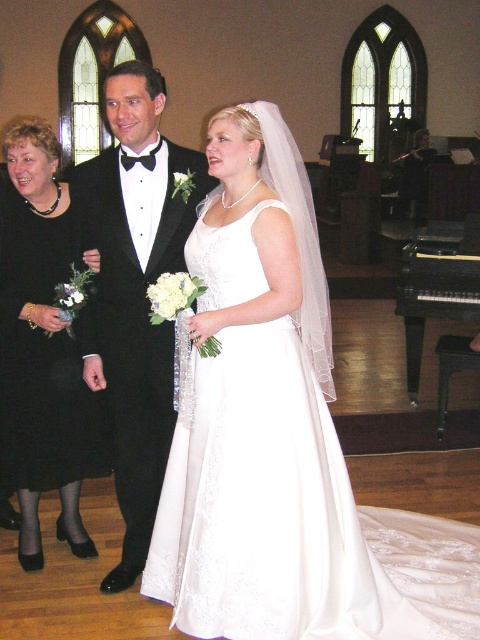
Can you confirm if white satin dress at center is bigger than black satin dress at left?

Yes, white satin dress at center is bigger than black satin dress at left.

Based on the photo, does white satin dress at center appear under black satin dress at left?

Yes.

Who is more distant from viewer, (x=410, y=604) or (x=36, y=531)?

The point (x=36, y=531) is more distant.

Find the location of a particular element. white satin dress at center is located at coordinates (291, 516).

In the scene shown: Can you confirm if black satin dress at left is positioned to the right of black polished wood piano at right?

No, black satin dress at left is not to the right of black polished wood piano at right.

Where is `black satin dress at left`? The height and width of the screenshot is (640, 480). black satin dress at left is located at coordinates (38, 340).

Is point (39, 144) less distant than point (476, 272)?

Yes, it is in front of point (476, 272).

Identify the location of black satin dress at left. The image size is (480, 640). (38, 340).

Which is above, white satin dress at center or black satin tuxedo at center?

black satin tuxedo at center

Is point (342, 544) in front of point (121, 138)?

Yes, it is.

Does point (282, 561) lie in front of point (123, 67)?

Yes, point (282, 561) is closer to viewer.

The height and width of the screenshot is (640, 480). Identify the location of white satin dress at center. (291, 516).